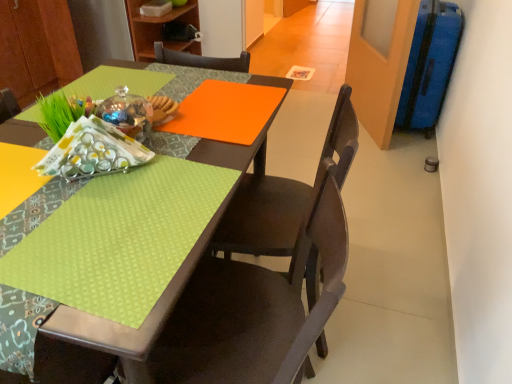
Identify the location of free location above lime green fabric at lower left (from a real-world perspective). (133, 215).